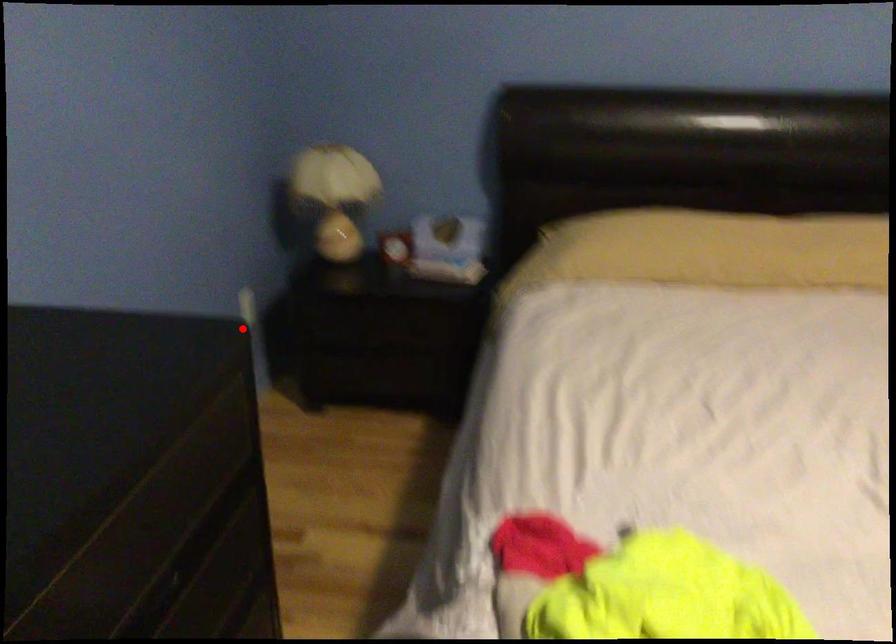
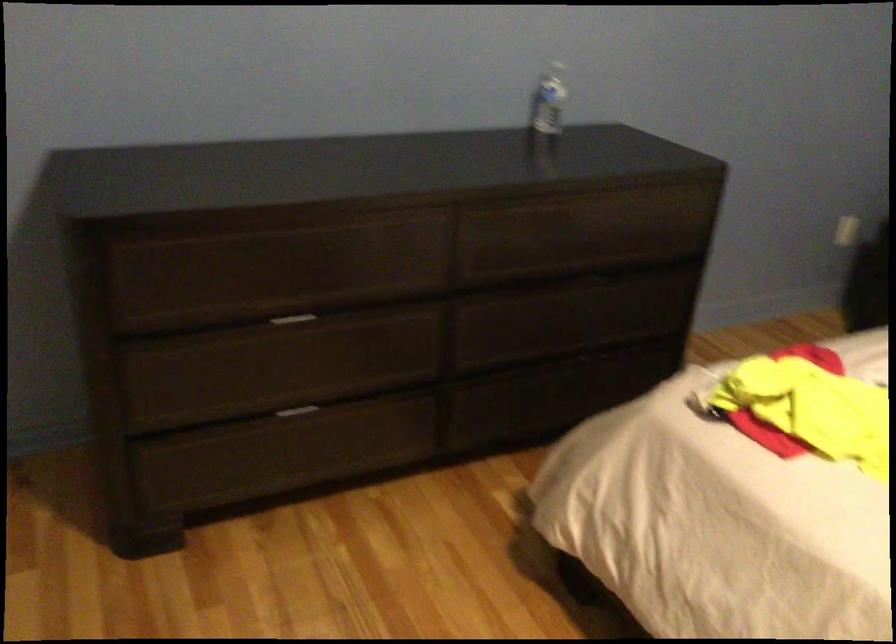
Where in the second image is the point corresponding to the highlighted location from the first image?

(848, 231)